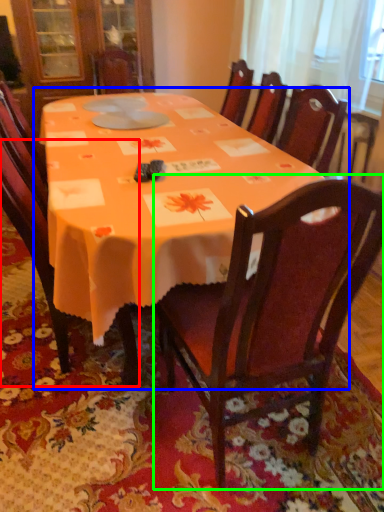
Question: Which object is positioned farthest from chair (highlighted by a red box)? Select from table (highlighted by a blue box) and chair (highlighted by a green box).

Choices:
 (A) table
 (B) chair

Answer: (B)